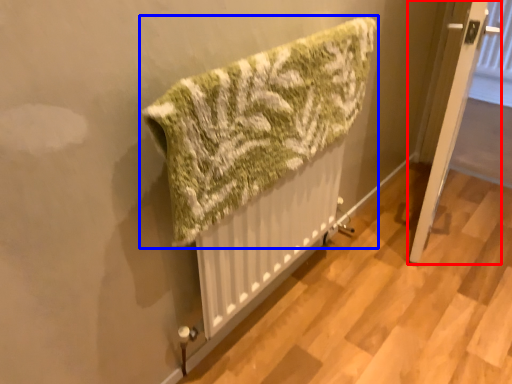
Question: Which point is further to the camera, door (highlighted by a red box) or towel (highlighted by a blue box)?

Choices:
 (A) door
 (B) towel

Answer: (A)